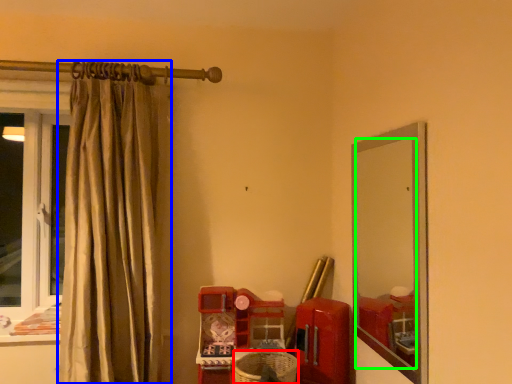
Question: Based on their relative distances, which object is farther from basket (highlighted by a red box)? Choose from curtain (highlighted by a blue box) and mirror (highlighted by a green box).

Choices:
 (A) curtain
 (B) mirror

Answer: (A)